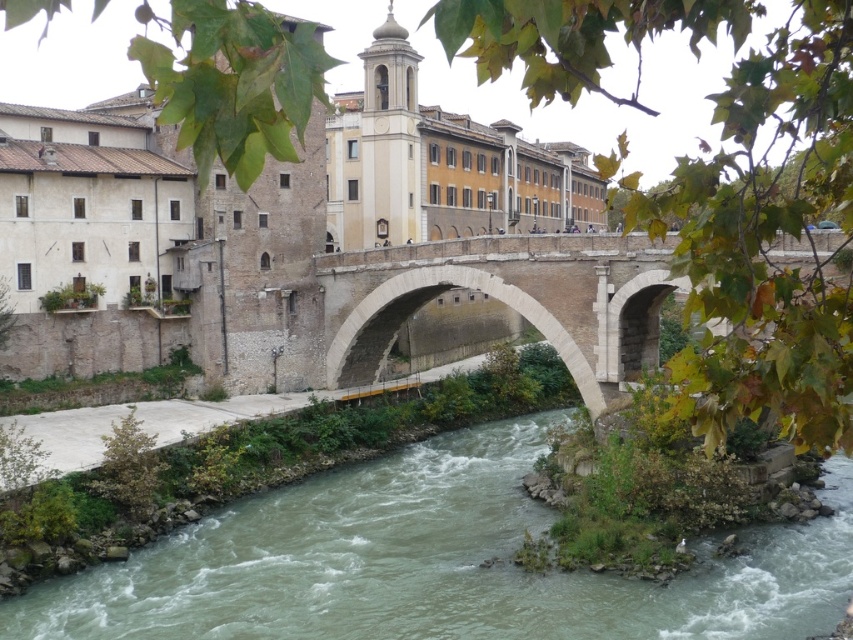
Question: Can you confirm if brown sedimentary rock river at lower center is positioned to the right of stone arch bridge at center?

Choices:
 (A) yes
 (B) no

Answer: (B)

Question: Which of the following is the farthest from the observer?

Choices:
 (A) brown sedimentary rock river at lower center
 (B) stone arch bridge at center

Answer: (A)

Question: Which point is closer to the camera?

Choices:
 (A) (805, 529)
 (B) (416, 305)

Answer: (A)

Question: Is brown sedimentary rock river at lower center positioned in front of stone arch bridge at center?

Choices:
 (A) yes
 (B) no

Answer: (B)

Question: Which of the following is the farthest from the observer?

Choices:
 (A) (717, 586)
 (B) (622, 252)

Answer: (B)

Question: Can you confirm if brown sedimentary rock river at lower center is positioned to the left of stone arch bridge at center?

Choices:
 (A) yes
 (B) no

Answer: (A)